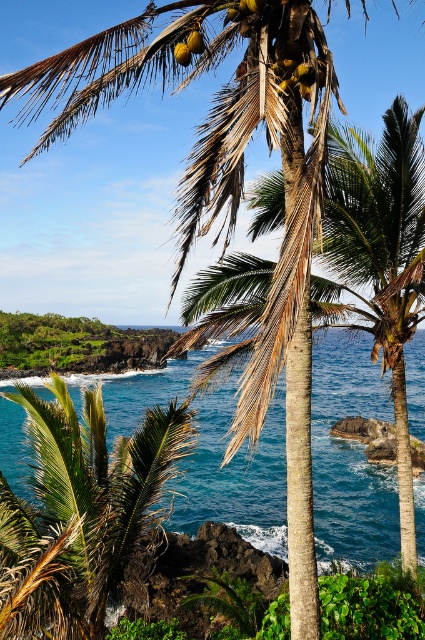
Based on the photo, can you confirm if green leafy palm tree at center is taller than yellow matte coconut at center?

Yes.

Locate an element on the screen. green leafy palm tree at center is located at coordinates (79, 509).

Who is more forward, (x=209, y=444) or (x=181, y=58)?

Point (x=181, y=58)

Who is taller, blue water at center or yellow matte coconut at upper center?

blue water at center

Locate an element on the screen. blue water at center is located at coordinates (350, 454).

Is green leafy palm tree at center above yellow matte coconut at upper center?

No, green leafy palm tree at center is not above yellow matte coconut at upper center.

Does point (79, 490) come in front of point (181, 65)?

Yes, point (79, 490) is closer to viewer.

Who is more forward, (11, 541) or (178, 61)?

Point (11, 541)

At what (x,y) coordinates should I click in order to perform the action: click on green leafy palm tree at center. Please return your answer as a coordinate pair (x, y). This screenshot has width=425, height=640. Looking at the image, I should click on (79, 509).